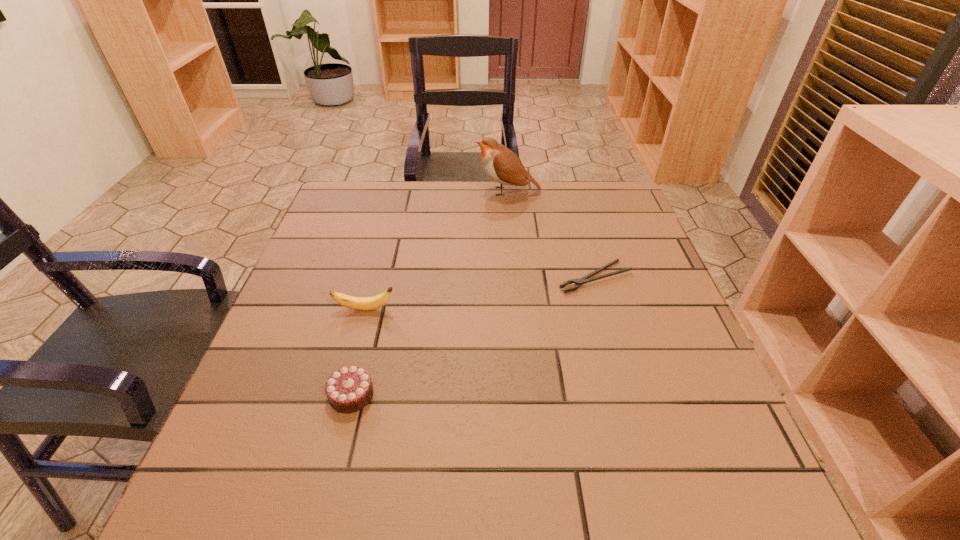
Where is `bird`? This screenshot has width=960, height=540. bird is located at coordinates (502, 165).

Where is `the farthest object`? This screenshot has height=540, width=960. the farthest object is located at coordinates (502, 165).

In order to click on the second tallest object in this screenshot , I will do `click(357, 303)`.

Where is `banana`? The image size is (960, 540). banana is located at coordinates (357, 303).

Image resolution: width=960 pixels, height=540 pixels. What are the coordinates of `the second shortest object` in the screenshot? It's located at (349, 389).

Where is `chocolate cake`? The image size is (960, 540). chocolate cake is located at coordinates (349, 389).

Locate an element on the screen. The width and height of the screenshot is (960, 540). the shortest object is located at coordinates (578, 282).

This screenshot has height=540, width=960. In order to click on the third nearest object in this screenshot , I will do point(578,282).

Identify the location of free space located 0.340m at the face of the bird. The width and height of the screenshot is (960, 540). (365, 191).

Where is `vacant region located 0.220m at the face of the bird`? vacant region located 0.220m at the face of the bird is located at coordinates click(x=403, y=191).